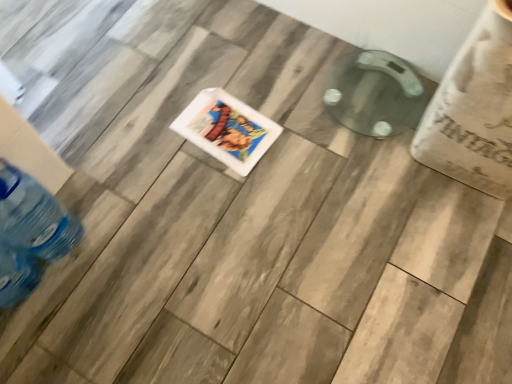
Question: Does point (253, 135) appear closer or farther from the camera than point (22, 208)?

Choices:
 (A) closer
 (B) farther

Answer: (B)

Question: Is white glossy comic book at center in front of or behind translucent plastic bottle at lower left in the image?

Choices:
 (A) behind
 (B) front

Answer: (A)

Question: Do you think white glossy comic book at center is within translucent plastic bottle at lower left, or outside of it?

Choices:
 (A) inside
 (B) outside

Answer: (B)

Question: Is translucent plastic bottle at lower left to the left or to the right of white glossy comic book at center in the image?

Choices:
 (A) right
 (B) left

Answer: (B)

Question: Does point (24, 226) appear closer or farther from the camera than point (276, 127)?

Choices:
 (A) farther
 (B) closer

Answer: (B)

Question: From their relative heights in the image, would you say translucent plastic bottle at lower left is taller or shorter than white glossy comic book at center?

Choices:
 (A) short
 (B) tall

Answer: (B)

Question: Is translucent plastic bottle at lower left in front of or behind white glossy comic book at center in the image?

Choices:
 (A) behind
 (B) front

Answer: (B)